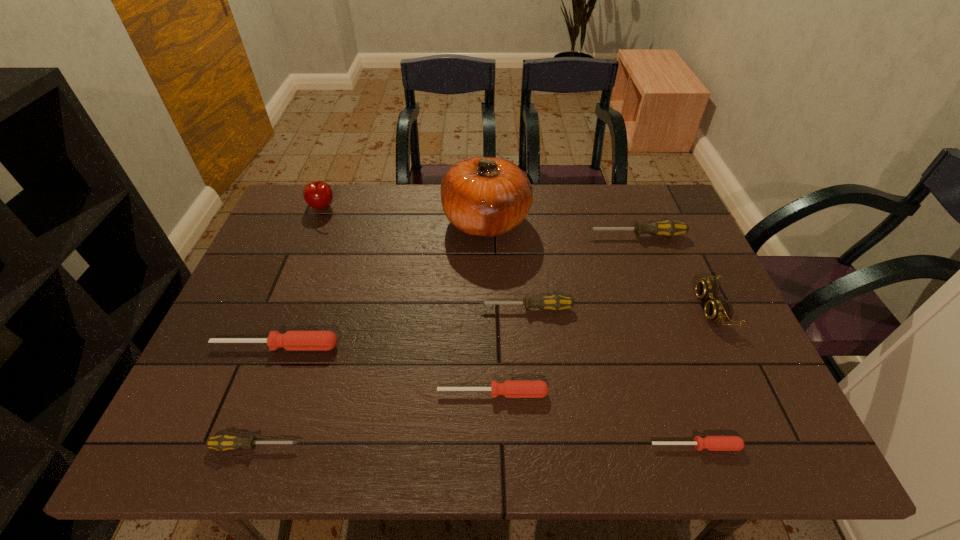
Locate an element on the screen. The width and height of the screenshot is (960, 540). free space located on the left of the nearest red screwdriver is located at coordinates pos(520,446).

At what (x,y) coordinates should I click in order to perform the action: click on pumpkin at the far edge. Please return your answer as a coordinate pair (x, y). The width and height of the screenshot is (960, 540). Looking at the image, I should click on (481, 196).

Where is `cherry at the far edge`? Image resolution: width=960 pixels, height=540 pixels. cherry at the far edge is located at coordinates (318, 194).

Image resolution: width=960 pixels, height=540 pixels. Find the location of `screwdriver located in the far edge section of the desktop`. screwdriver located in the far edge section of the desktop is located at coordinates (669, 228).

In order to click on cherry located at the left edge in this screenshot , I will do `click(318, 194)`.

Identify the location of goggles present at the right edge. (719, 310).

Where is `object at the far left corner`? The width and height of the screenshot is (960, 540). object at the far left corner is located at coordinates (318, 194).

Identify the location of object at the near left corner. (223, 442).

At what (x,y) coordinates should I click in order to perform the action: click on object that is at the far right corner. Please return your answer as a coordinate pair (x, y). Looking at the image, I should click on (669, 228).

This screenshot has width=960, height=540. Identify the location of object located at the near right corner. (713, 443).